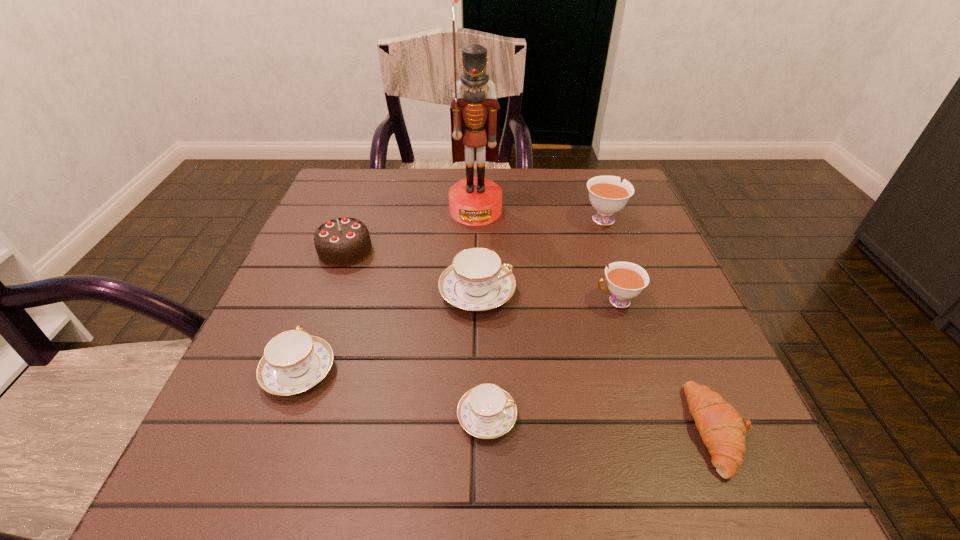
The height and width of the screenshot is (540, 960). In order to click on red nutcracker in this screenshot , I will do `click(475, 118)`.

Locate an element on the screen. the tallest object is located at coordinates (475, 118).

Find the location of a particular element. This screenshot has width=960, height=540. the farthest teacup is located at coordinates (607, 194).

Find the location of a particular element. This screenshot has height=540, width=960. the farther white teacup is located at coordinates (607, 194).

Where is `the sixth nearest object`? The image size is (960, 540). the sixth nearest object is located at coordinates (340, 242).

Where is `chocolate chocolate cake`? chocolate chocolate cake is located at coordinates (340, 242).

Find the location of a particular element. The width and height of the screenshot is (960, 540). the farthest blue teacup is located at coordinates (477, 280).

Find the location of a particular element. The image size is (960, 540). the smaller white teacup is located at coordinates (625, 280).

Find the location of a particular element. This screenshot has width=960, height=540. the leftmost blue teacup is located at coordinates [x=294, y=361].

In order to click on the second biggest blue teacup in this screenshot , I will do `click(294, 361)`.